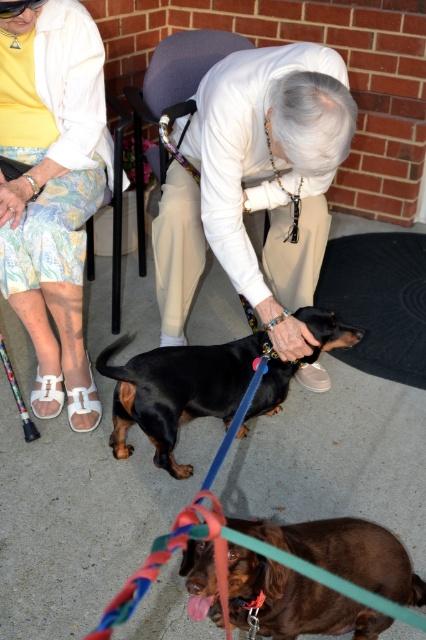
You are a dog trainer observing the two dachshunds in the image. Which of the two dogs, the smooth black dog at center or the black smooth dachshund at center, would you expect to have a larger size based on their descriptions?

The smooth black dog at center is bigger than the black smooth dachshund at center, so the smooth black dog at center would be the larger one.

You are standing at the center of the patio and want to find the brown glossy dog at lower center. Based on the coordinates provided, in which direction should you look to locate it?

The brown glossy dog at lower center is located at coordinates point (293, 600), which means it is positioned to the right and slightly below the center of the image. Therefore, you should look to your right and downward from the center to find it.